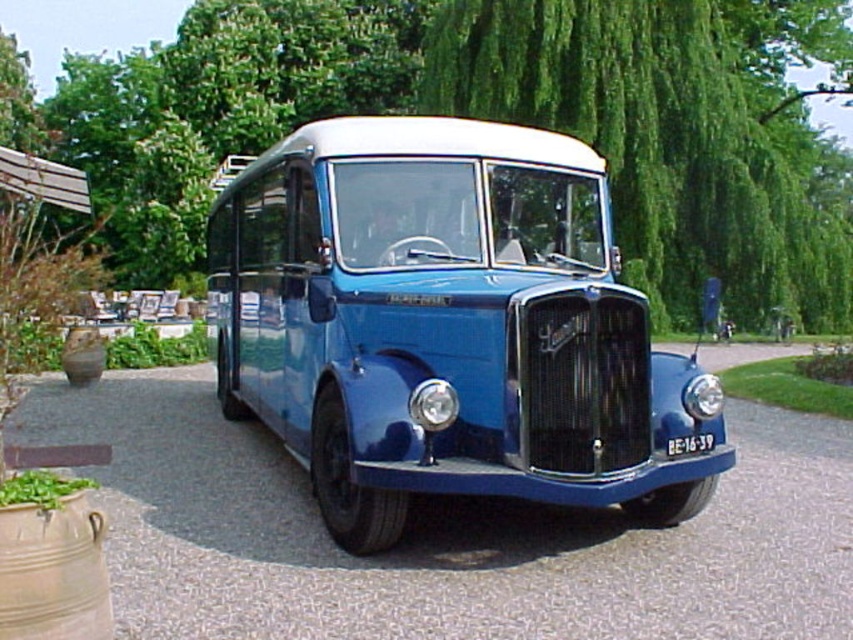
You are a delivery person trying to park a small delivery van that is 2 meters wide. You see the blue asphalt driveway at center and the white plastic license plate at center. Can the driveway accommodate your van?

The blue asphalt driveway at center might be wider than white plastic license plate at center, so it is possible that the driveway can accommodate the van, but there is uncertainty due to the comparison being uncertain.

You are a delivery person trying to read the license plate on the vintage bus. There is a green leafy tree at center blocking your view. Can you see the white plastic license plate at center clearly?

The green leafy tree at center is located above the white plastic license plate at center, so the tree might be partially blocking the view of the license plate, making it difficult to read clearly.

You are standing at the entrance of the driveway and want to take a photo of the vintage bus parked there. To ensure the green leafy tree at center is not blocking the view, where should you position yourself relative to the driveway?

The green leafy tree at center is located at point [494,118] in the image. To avoid the tree blocking the view of the vintage bus, position yourself to the left or right side of the driveway, away from the center area where the tree is situated.